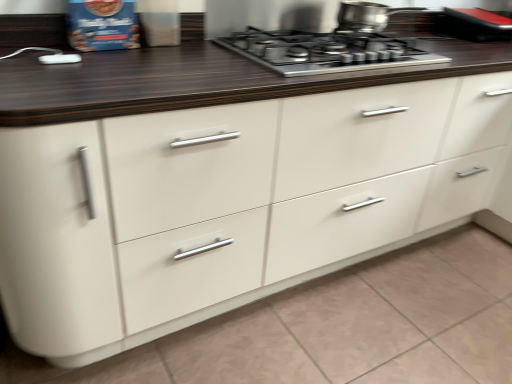
This screenshot has height=384, width=512. Identify the location of stainless steel gas stove at upper center. (326, 51).

You are a GUI agent. You are given a task and a screenshot of the screen. Output one action in this format:
    pyautogui.click(x=<x>, y=<y>)
    Task: Click on the black rubberized phone at upper right
    The width and height of the screenshot is (512, 384).
    Given the screenshot: What is the action you would take?
    pyautogui.click(x=475, y=24)

Does stainless steel pot at upper center appear on the left side of black rubberized phone at upper right?

Indeed, stainless steel pot at upper center is positioned on the left side of black rubberized phone at upper right.

Is point (353, 13) closer or farther from the camera than point (455, 19)?

Point (353, 13) is positioned closer to the camera compared to point (455, 19).

Looking at this image, does stainless steel pot at upper center have a larger size compared to black rubberized phone at upper right?

Incorrect, stainless steel pot at upper center is not larger than black rubberized phone at upper right.

Can you confirm if stainless steel gas stove at upper center is positioned to the right of stainless steel pot at upper center?

Incorrect, stainless steel gas stove at upper center is not on the right side of stainless steel pot at upper center.

Is stainless steel gas stove at upper center aimed at stainless steel pot at upper center?

No.

Considering the positions of objects stainless steel gas stove at upper center and stainless steel pot at upper center in the image provided, who is in front, stainless steel gas stove at upper center or stainless steel pot at upper center?

stainless steel gas stove at upper center.

Considering the sizes of objects stainless steel gas stove at upper center and stainless steel pot at upper center in the image provided, who is wider, stainless steel gas stove at upper center or stainless steel pot at upper center?

stainless steel gas stove at upper center.

Considering the relative sizes of stainless steel pot at upper center and stainless steel gas stove at upper center in the image provided, is stainless steel pot at upper center bigger than stainless steel gas stove at upper center?

Actually, stainless steel pot at upper center might be smaller than stainless steel gas stove at upper center.

Is stainless steel pot at upper center facing away from stainless steel gas stove at upper center?

No, stainless steel pot at upper center's orientation is not away from stainless steel gas stove at upper center.

Which is behind, stainless steel pot at upper center or stainless steel gas stove at upper center?

stainless steel pot at upper center is further from the camera.

From a real-world perspective, is stainless steel pot at upper center physically above stainless steel gas stove at upper center?

Yes.

Is stainless steel gas stove at upper center positioned behind black rubberized phone at upper right?

That is False.

Based on their sizes in the image, would you say stainless steel gas stove at upper center is bigger or smaller than black rubberized phone at upper right?

Clearly, stainless steel gas stove at upper center is larger in size than black rubberized phone at upper right.

Does point (389, 51) come closer to viewer compared to point (461, 32)?

Yes, it is.

Is stainless steel gas stove at upper center taller than black rubberized phone at upper right?

No.

Is black rubberized phone at upper right outside of stainless steel gas stove at upper center?

Yes, black rubberized phone at upper right is outside of stainless steel gas stove at upper center.

Is black rubberized phone at upper right next to stainless steel gas stove at upper center?

There is a gap between black rubberized phone at upper right and stainless steel gas stove at upper center.

Considering the sizes of black rubberized phone at upper right and stainless steel gas stove at upper center in the image, is black rubberized phone at upper right bigger or smaller than stainless steel gas stove at upper center?

In the image, black rubberized phone at upper right appears to be smaller than stainless steel gas stove at upper center.

Considering the sizes of black rubberized phone at upper right and stainless steel pot at upper center in the image, is black rubberized phone at upper right taller or shorter than stainless steel pot at upper center?

black rubberized phone at upper right is taller than stainless steel pot at upper center.

Considering the sizes of black rubberized phone at upper right and stainless steel pot at upper center in the image, is black rubberized phone at upper right bigger or smaller than stainless steel pot at upper center?

black rubberized phone at upper right is bigger than stainless steel pot at upper center.

How many degrees apart are the facing directions of black rubberized phone at upper right and stainless steel pot at upper center?

The facing directions of black rubberized phone at upper right and stainless steel pot at upper center are 0.000498 degrees apart.

Consider the image. Does black rubberized phone at upper right touch stainless steel pot at upper center?

No.

Image resolution: width=512 pixels, height=384 pixels. What are the coordinates of `appliance below the stainless steel pot at upper center (from a real-world perspective)` in the screenshot? It's located at (475, 24).

This screenshot has width=512, height=384. I want to click on gas stove below the stainless steel pot at upper center (from the image's perspective), so click(x=326, y=51).

Considering their positions, is stainless steel gas stove at upper center positioned closer to black rubberized phone at upper right than stainless steel pot at upper center?

stainless steel pot at upper center.

Which object lies nearer to the anchor point stainless steel gas stove at upper center, stainless steel pot at upper center or black rubberized phone at upper right?

Based on the image, stainless steel pot at upper center appears to be nearer to stainless steel gas stove at upper center.

Considering their positions, is black rubberized phone at upper right positioned closer to stainless steel gas stove at upper center than stainless steel pot at upper center?

stainless steel pot at upper center lies closer to stainless steel gas stove at upper center than the other object.

Based on their spatial positions, is black rubberized phone at upper right or stainless steel gas stove at upper center closer to stainless steel pot at upper center?

stainless steel gas stove at upper center is positioned closer to the anchor stainless steel pot at upper center.

Which object lies nearer to the anchor point black rubberized phone at upper right, stainless steel pot at upper center or stainless steel gas stove at upper center?

The object closer to black rubberized phone at upper right is stainless steel pot at upper center.

Based on their spatial positions, is stainless steel gas stove at upper center or black rubberized phone at upper right closer to stainless steel pot at upper center?

stainless steel gas stove at upper center lies closer to stainless steel pot at upper center than the other object.

You are a GUI agent. You are given a task and a screenshot of the screen. Output one action in this format:
    pyautogui.click(x=<x>, y=<y>)
    Task: Click on the kitchen appliance situated between stainless steel gas stove at upper center and black rubberized phone at upper right from left to right
    
    Given the screenshot: What is the action you would take?
    pyautogui.click(x=367, y=16)